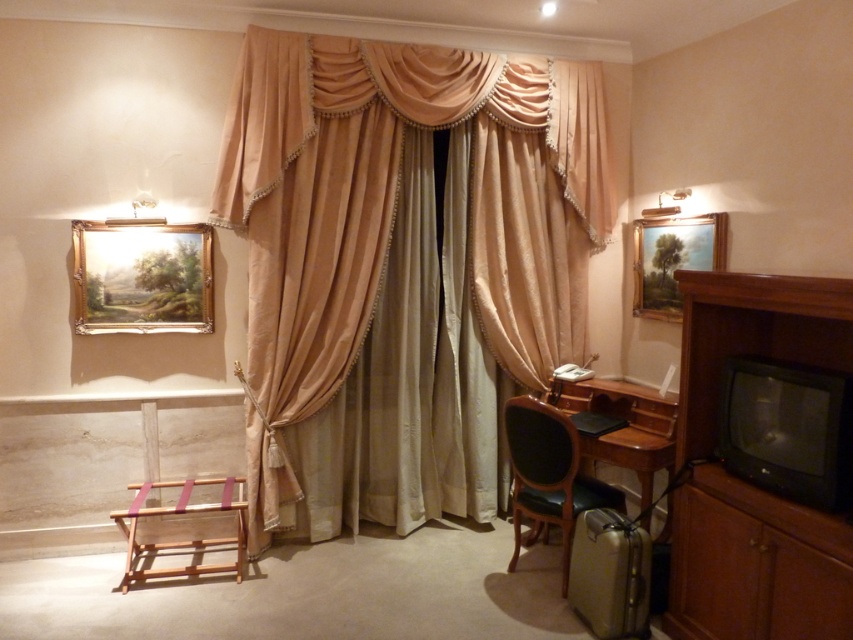
Based on the photo, which is more to the right, brown wood dresser at right or metallic gold lampshade at upper right?

From the viewer's perspective, metallic gold lampshade at upper right appears more on the right side.

Is brown wood dresser at right to the right of metallic gold lampshade at upper right from the viewer's perspective?

No, brown wood dresser at right is not to the right of metallic gold lampshade at upper right.

Does point (793, 593) lie behind point (662, 198)?

No, (793, 593) is in front of (662, 198).

Locate an element on the screen. Image resolution: width=853 pixels, height=640 pixels. brown wood dresser at right is located at coordinates (753, 564).

Does wooden desk at lower right have a lesser width compared to wooden stool at lower left?

Correct, wooden desk at lower right's width is less than wooden stool at lower left's.

Which is above, wooden desk at lower right or wooden stool at lower left?

wooden desk at lower right

Is point (599, 445) farther from camera compared to point (230, 484)?

No, (599, 445) is closer to viewer.

Find the location of a particular element. wooden desk at lower right is located at coordinates (624, 428).

Who is lower down, dark green leather chair at lower right or wooden stool at lower left?

Positioned lower is wooden stool at lower left.

Is dark green leather chair at lower right above wooden stool at lower left?

Yes.

Identify the location of dark green leather chair at lower right. This screenshot has height=640, width=853. (548, 474).

You are a GUI agent. You are given a task and a screenshot of the screen. Output one action in this format:
    pyautogui.click(x=<x>, y=<y>)
    Task: Click on the dark green leather chair at lower right
    The height and width of the screenshot is (640, 853).
    Given the screenshot: What is the action you would take?
    pyautogui.click(x=548, y=474)